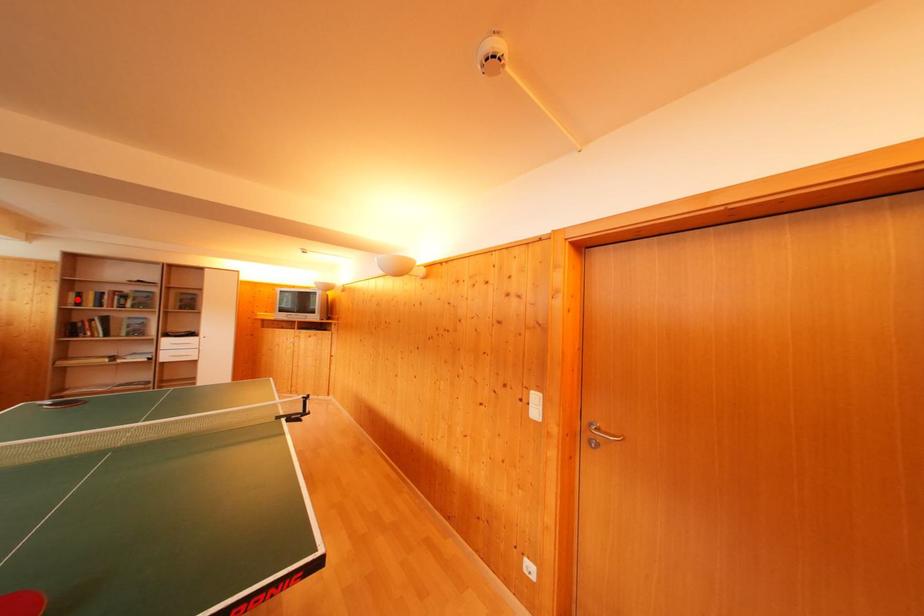
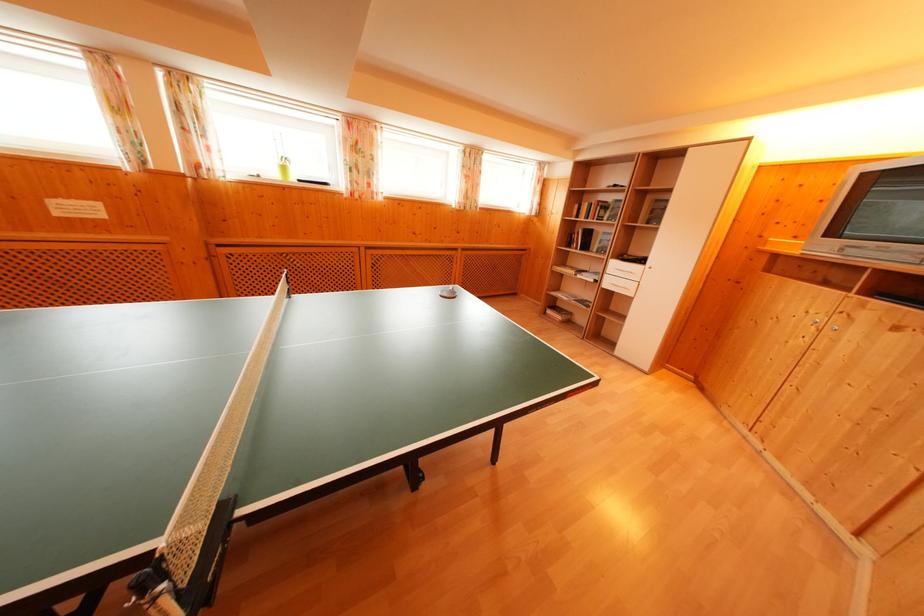
The point at the highlighted location is marked in the first image. Where is the corresponding point in the second image?

(581, 211)